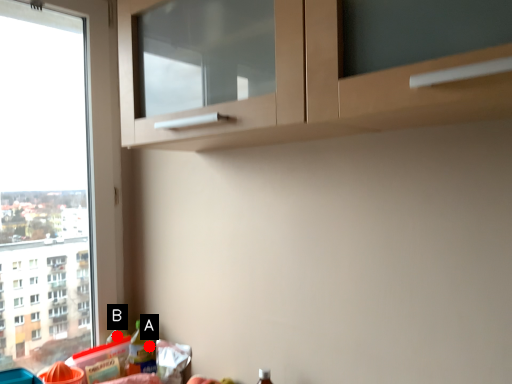
Question: Two points are circled on the image, labeled by A and B beside each circle. Which point appears farthest from the camera in this image?

Choices:
 (A) A is further
 (B) B is further

Answer: (A)